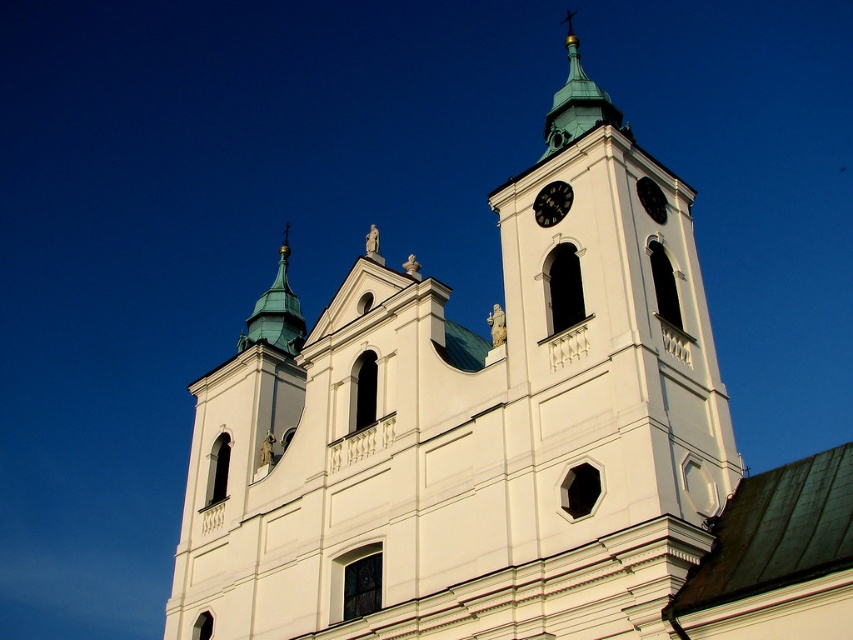
Question: Does green copper spire at upper center come in front of black glossy clock at upper center?

Choices:
 (A) no
 (B) yes

Answer: (A)

Question: Does shiny green spire at upper center have a smaller size compared to black glossy clock at upper center?

Choices:
 (A) yes
 (B) no

Answer: (B)

Question: Does shiny green spire at upper center have a smaller size compared to black glossy clock at upper center?

Choices:
 (A) no
 (B) yes

Answer: (A)

Question: Which object is positioned closest to the green copper spire at upper center?

Choices:
 (A) white stone tower at center
 (B) black glossy clock at upper center
 (C) shiny green spire at upper center

Answer: (B)

Question: Which object is positioned closest to the white stone tower at center?

Choices:
 (A) green copper spire at upper center
 (B) black glossy clock at upper center

Answer: (B)

Question: Which object appears closest to the camera in this image?

Choices:
 (A) shiny green spire at upper center
 (B) white stone tower at center

Answer: (B)